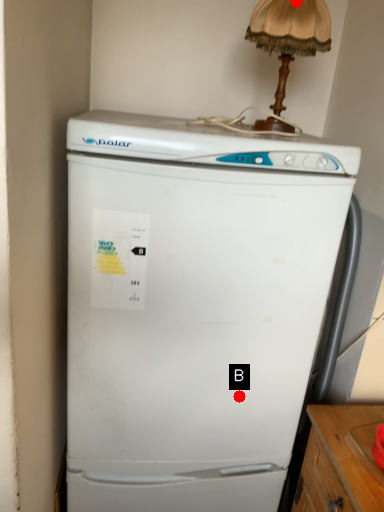
Question: Two points are circled on the image, labeled by A and B beside each circle. Which point is closer to the camera taking this photo?

Choices:
 (A) A is closer
 (B) B is closer

Answer: (A)